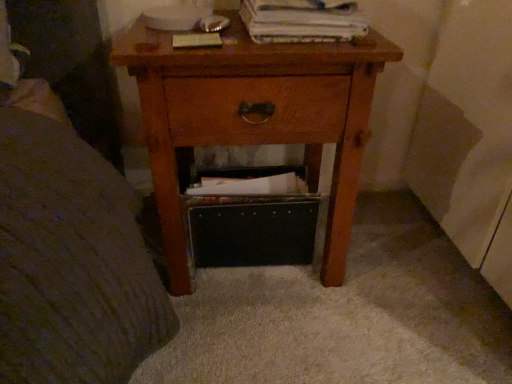
Question: Is matte brown paperback book at upper center, the second paperback book from the right, aimed at white paper at upper center, arranged as the first paperback book when viewed from the right?

Choices:
 (A) no
 (B) yes

Answer: (A)

Question: Is matte brown paperback book at upper center, the second paperback book from the right, bigger than white paper at upper center, arranged as the first paperback book when viewed from the right?

Choices:
 (A) yes
 (B) no

Answer: (B)

Question: From a real-world perspective, does matte brown paperback book at upper center, which is the 1th paperback book from left to right, stand above white paper at upper center, the second paperback book viewed from the left?

Choices:
 (A) yes
 (B) no

Answer: (B)

Question: Is white paper at upper center, arranged as the first paperback book when viewed from the right, at the back of matte brown paperback book at upper center, the second paperback book from the right?

Choices:
 (A) yes
 (B) no

Answer: (B)

Question: Is matte brown paperback book at upper center, which is the 1th paperback book from left to right, not within white paper at upper center, arranged as the first paperback book when viewed from the right?

Choices:
 (A) no
 (B) yes

Answer: (B)

Question: Is matte brown paperback book at upper center, the second paperback book from the right, to the left of white paper at upper center, the second paperback book viewed from the left, from the viewer's perspective?

Choices:
 (A) no
 (B) yes

Answer: (B)

Question: Does white paper at upper center, the second paperback book viewed from the left, come behind matte brown paperback book at upper center, which is the 1th paperback book from left to right?

Choices:
 (A) no
 (B) yes

Answer: (A)

Question: Can you confirm if white paper at upper center, arranged as the first paperback book when viewed from the right, is bigger than matte brown paperback book at upper center, the second paperback book from the right?

Choices:
 (A) no
 (B) yes

Answer: (B)

Question: Considering the relative sizes of white paper at upper center, arranged as the first paperback book when viewed from the right, and matte brown paperback book at upper center, the second paperback book from the right, in the image provided, is white paper at upper center, arranged as the first paperback book when viewed from the right, taller than matte brown paperback book at upper center, the second paperback book from the right,?

Choices:
 (A) no
 (B) yes

Answer: (B)

Question: Is white paper at upper center, arranged as the first paperback book when viewed from the right, not close to matte brown paperback book at upper center, the second paperback book from the right?

Choices:
 (A) no
 (B) yes

Answer: (A)

Question: Can you confirm if white paper at upper center, the second paperback book viewed from the left, is thinner than matte brown paperback book at upper center, the second paperback book from the right?

Choices:
 (A) yes
 (B) no

Answer: (B)

Question: Does white paper at upper center, the second paperback book viewed from the left, appear on the left side of matte brown paperback book at upper center, which is the 1th paperback book from left to right?

Choices:
 (A) yes
 (B) no

Answer: (B)

Question: Is white paper at upper center, the second paperback book viewed from the left, wider than wooden nightstand at center?

Choices:
 (A) yes
 (B) no

Answer: (B)